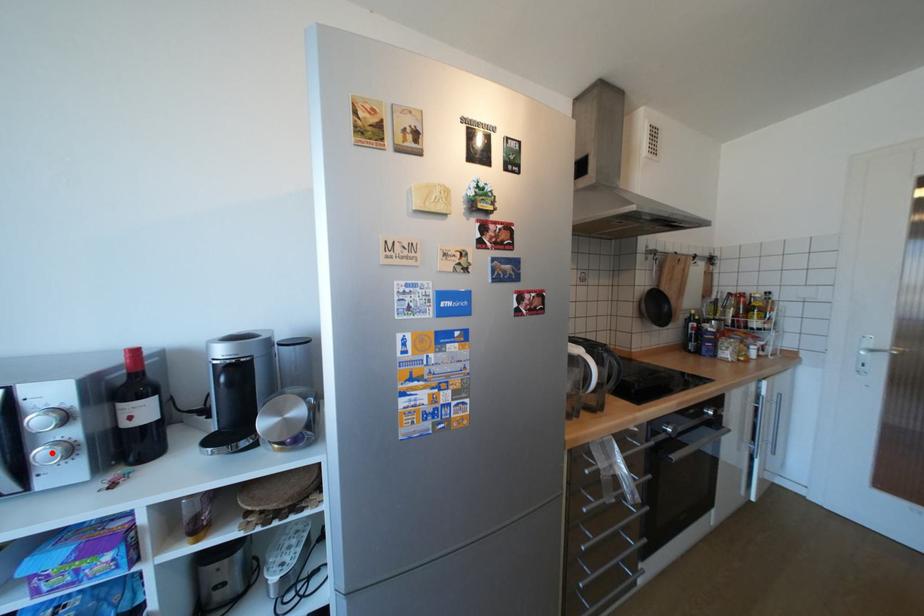
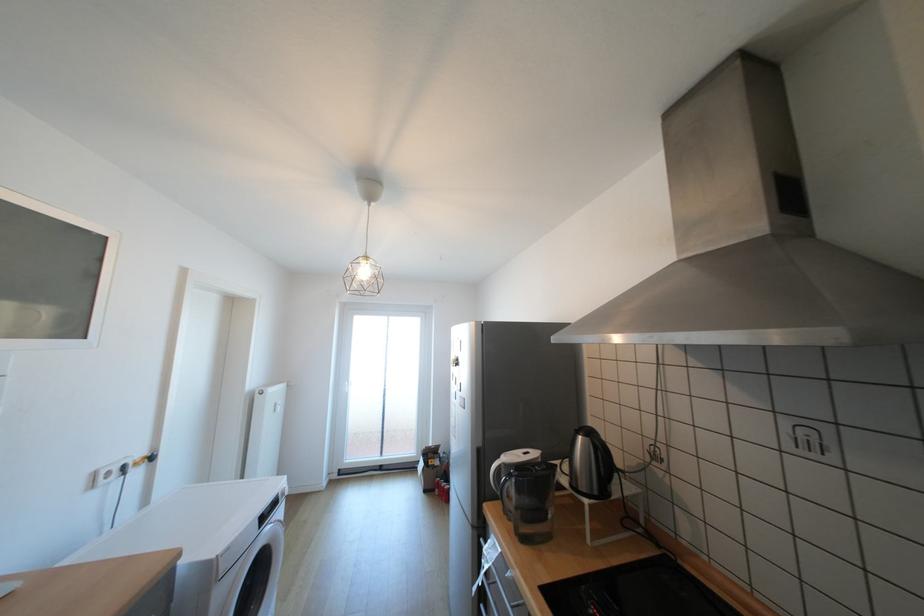
Question: I am providing you with two images of the same scene from different viewpoints. A red point is marked on the first image. Is the red point's position out of view in image 2?

Choices:
 (A) Yes
 (B) No

Answer: (A)